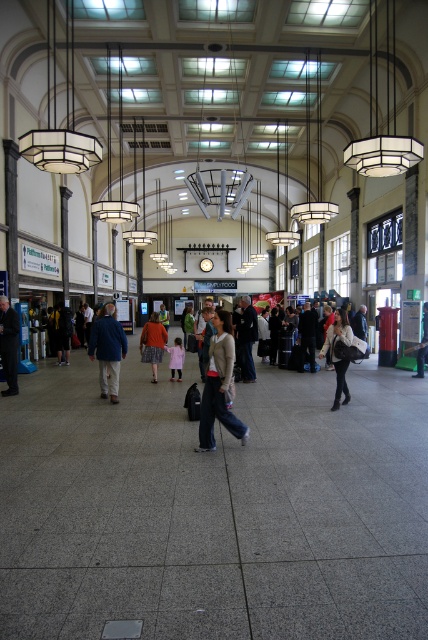
Is point (8, 342) closer to camera compared to point (347, 330)?

No.

Is point (3, 355) positioned behind point (326, 348)?

Yes, it is behind point (326, 348).

Where is `dark blue suit at left`? This screenshot has height=640, width=428. dark blue suit at left is located at coordinates (8, 344).

Is dark blue suit at left shorter than pink fabric dress at center?

No.

Between point (14, 372) and point (178, 348), which one is positioned in front?

Point (14, 372) is more forward.

This screenshot has height=640, width=428. I want to click on dark blue suit at left, so click(8, 344).

Based on the photo, is matte beige sweater at center closer to camera compared to dark blue jeans at center?

Yes, matte beige sweater at center is in front of dark blue jeans at center.

Between matte beige sweater at center and dark blue jeans at center, which one appears on the left side from the viewer's perspective?

Positioned to the left is matte beige sweater at center.

Identify the location of matte beige sweater at center. (219, 385).